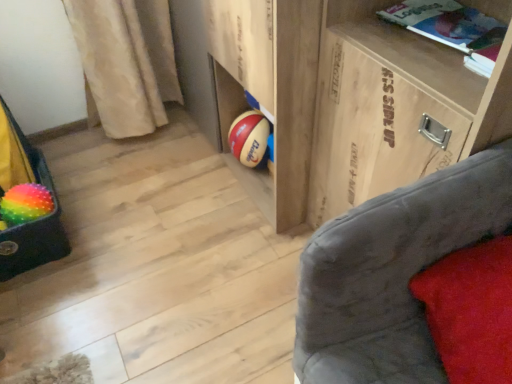
At what (x,y) coordinates should I click in order to perform the action: click on space that is in front of rainbow fuzzy bean bag chair at left. Please return your answer as a coordinate pair (x, y). Looking at the image, I should click on (41, 301).